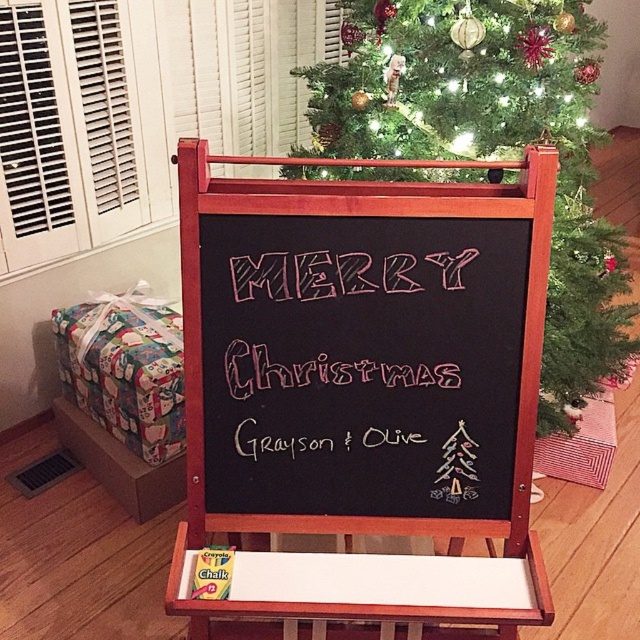
Does black chalkboard at center have a larger size compared to pink chalk merry christmas at center?

Correct, black chalkboard at center is larger in size than pink chalk merry christmas at center.

The width and height of the screenshot is (640, 640). What do you see at coordinates (358, 349) in the screenshot? I see `black chalkboard at center` at bounding box center [358, 349].

Where is `black chalkboard at center`? black chalkboard at center is located at coordinates 358,349.

Is black chalkboard at center bigger than green textured christmas tree at upper center?

Actually, black chalkboard at center might be smaller than green textured christmas tree at upper center.

Which is in front, point (388, 204) or point (403, 74)?

Point (388, 204) is in front.

The height and width of the screenshot is (640, 640). In order to click on black chalkboard at center in this screenshot , I will do [358, 349].

Is green textured christmas tree at upper center to the left of pink chalk merry christmas at center from the viewer's perspective?

In fact, green textured christmas tree at upper center is to the right of pink chalk merry christmas at center.

Who is more distant from viewer, [611,360] or [252,289]?

The point [611,360] is behind.

The width and height of the screenshot is (640, 640). What are the coordinates of `green textured christmas tree at upper center` in the screenshot? It's located at (493, 147).

Locate an element on the screen. green textured christmas tree at upper center is located at coordinates (493, 147).